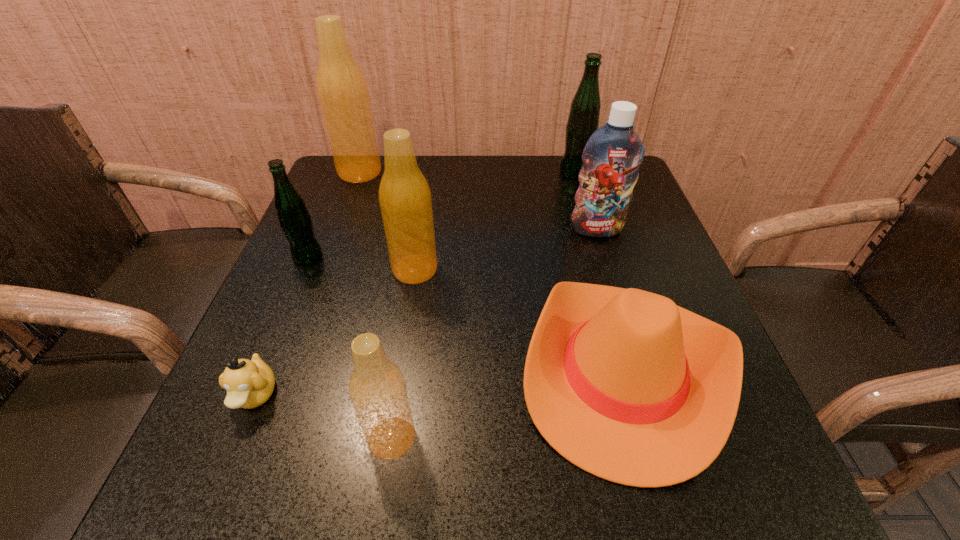
Locate an element on the screen. the tallest beer bottle is located at coordinates (342, 90).

The height and width of the screenshot is (540, 960). What are the coordinates of `the biggest tan beer bottle` in the screenshot? It's located at (342, 90).

Locate an element on the screen. the right green beer bottle is located at coordinates [583, 120].

Find the location of a particular element. the bigger green beer bottle is located at coordinates (583, 120).

The height and width of the screenshot is (540, 960). Identify the location of the second nearest tan beer bottle. (405, 199).

Find the location of a particular element. shampoo is located at coordinates (611, 158).

In order to click on the sixth nearest object in this screenshot , I will do `click(611, 158)`.

Identify the location of the left green beer bottle. (295, 221).

Identify the location of the smaller green beer bottle. (295, 221).

The height and width of the screenshot is (540, 960). I want to click on the smallest tan beer bottle, so click(377, 388).